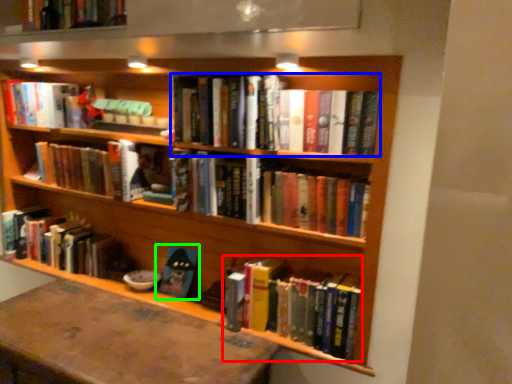
Question: Which object is the farthest from book (highlighted by a red box)? Choose among these: book (highlighted by a blue box) or book (highlighted by a green box).

Choices:
 (A) book
 (B) book

Answer: (A)